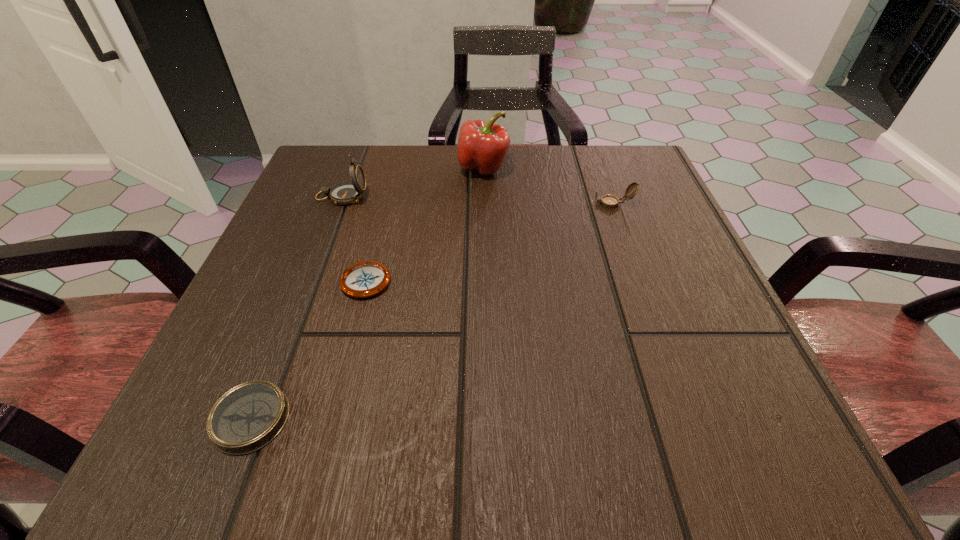
Locate an element on the screen. Image resolution: width=960 pixels, height=540 pixels. object present at the far right corner is located at coordinates (608, 201).

I want to click on vacant area at the far edge, so click(x=573, y=205).

Locate an element on the screen. Image resolution: width=960 pixels, height=540 pixels. free space at the near edge is located at coordinates (438, 420).

In the image, there is a desktop. Find the location of `vacant space at the left edge`. vacant space at the left edge is located at coordinates 242,301.

The height and width of the screenshot is (540, 960). Find the location of `free space at the right edge of the desktop`. free space at the right edge of the desktop is located at coordinates (675, 308).

You are a GUI agent. You are given a task and a screenshot of the screen. Output one action in this format:
    pyautogui.click(x=<x>, y=<y>)
    Task: Click on the free space at the far left corner of the desktop
    This screenshot has width=960, height=540.
    Given the screenshot: What is the action you would take?
    pyautogui.click(x=377, y=177)

The height and width of the screenshot is (540, 960). I want to click on vacant space at the far right corner of the desktop, so click(x=641, y=175).

At what (x,y) coordinates should I click in order to perform the action: click on free space that is in between the second object from right to left and the third object from right to left. Please return your answer as a coordinate pair (x, y). The height and width of the screenshot is (540, 960). Looking at the image, I should click on (425, 224).

This screenshot has height=540, width=960. Find the location of `vacant area between the nearest object and the rightmost object`. vacant area between the nearest object and the rightmost object is located at coordinates (432, 311).

Find the location of a particular element. The width and height of the screenshot is (960, 540). vacant space that is in between the third object from left to right and the tallest compass is located at coordinates (354, 239).